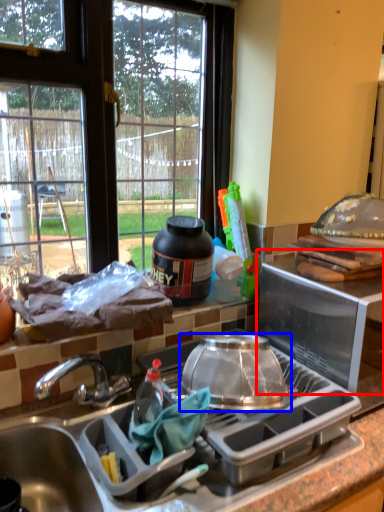
Question: Among these objects, which one is nearest to the camera, appliance (highlighted by a red box) or kitchen appliance (highlighted by a blue box)?

Choices:
 (A) appliance
 (B) kitchen appliance

Answer: (B)